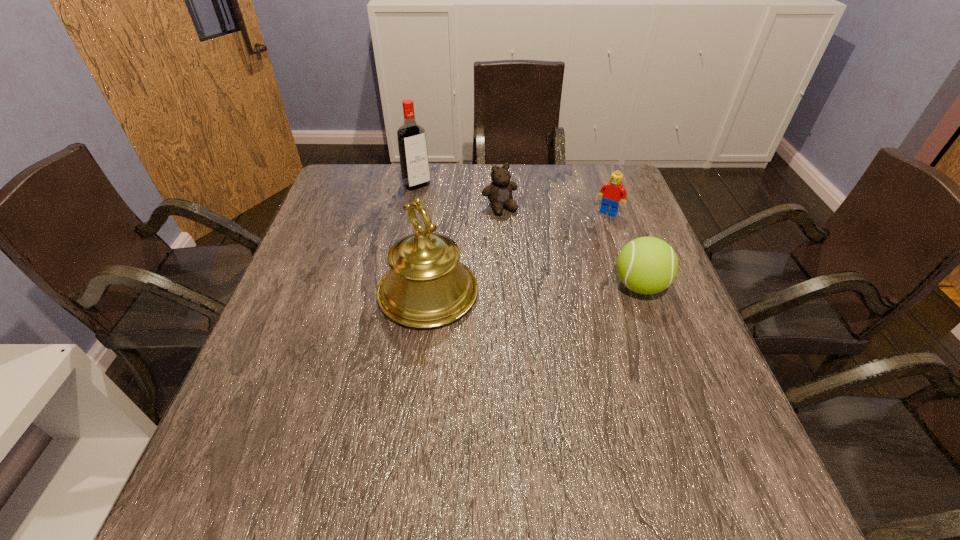
This screenshot has width=960, height=540. What are the coordinates of `bell` in the screenshot? It's located at tap(427, 286).

Image resolution: width=960 pixels, height=540 pixels. I want to click on tennis ball, so click(x=647, y=265).

You are a GUI agent. You are given a task and a screenshot of the screen. Output one action in this format:
    pyautogui.click(x=<x>, y=<y>)
    Task: Click on the Lego
    This screenshot has width=960, height=540.
    Given the screenshot: What is the action you would take?
    pyautogui.click(x=612, y=192)

Find the location of `vodka`. vodka is located at coordinates (413, 154).

The image size is (960, 540). I want to click on the third object from left to right, so click(x=499, y=192).

You are a GUI agent. You are given a task and a screenshot of the screen. Output one action in this format:
    pyautogui.click(x=<x>, y=<y>)
    Task: Click on the vacant space located 0.250m on the right of the bell
    This screenshot has width=960, height=540.
    Given the screenshot: What is the action you would take?
    pyautogui.click(x=585, y=293)

The image size is (960, 540). I want to click on vacant space positioned 0.230m on the front of the tennis ball, so click(680, 396).

This screenshot has width=960, height=540. I want to click on vacant space positioned on the face of the Lego, so click(x=576, y=260).

Identify the location of vacant space located on the face of the Lego. point(586,245).

Find the location of a particular element. free space located on the face of the Lego is located at coordinates (561, 284).